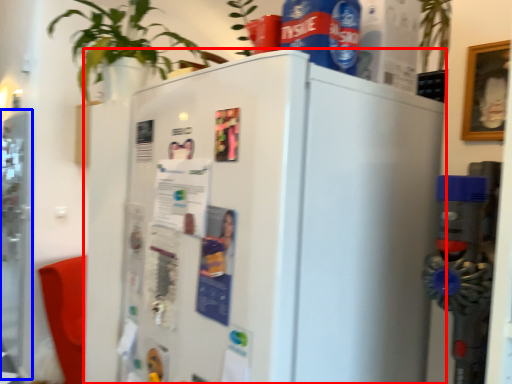
Question: Which object appears closest to the camera in this image, refrigerator (highlighted by a red box) or screen door (highlighted by a blue box)?

Choices:
 (A) refrigerator
 (B) screen door

Answer: (A)